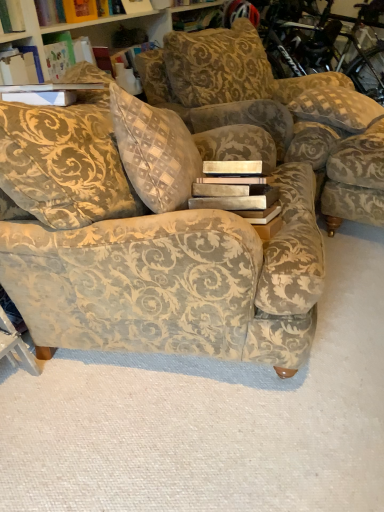
Question: Are velvet floral armchair at right and velvet-patterned couch at center making contact?

Choices:
 (A) yes
 (B) no

Answer: (B)

Question: Does velvet floral armchair at right have a smaller size compared to velvet-patterned couch at center?

Choices:
 (A) yes
 (B) no

Answer: (A)

Question: From the image's perspective, is velvet floral armchair at right beneath velvet-patterned couch at center?

Choices:
 (A) yes
 (B) no

Answer: (B)

Question: Does velvet floral armchair at right have a larger size compared to velvet-patterned couch at center?

Choices:
 (A) no
 (B) yes

Answer: (A)

Question: Is the depth of velvet floral armchair at right greater than that of velvet-patterned couch at center?

Choices:
 (A) no
 (B) yes

Answer: (B)

Question: Does velvet floral armchair at right have a greater height compared to velvet-patterned couch at center?

Choices:
 (A) no
 (B) yes

Answer: (A)

Question: Is checkered fabric pillow at upper right thinner than velvet-patterned couch at center?

Choices:
 (A) yes
 (B) no

Answer: (A)

Question: From the image's perspective, is checkered fabric pillow at upper right under velvet-patterned couch at center?

Choices:
 (A) no
 (B) yes

Answer: (A)

Question: Does checkered fabric pillow at upper right have a smaller size compared to velvet-patterned couch at center?

Choices:
 (A) no
 (B) yes

Answer: (B)

Question: From a real-world perspective, is checkered fabric pillow at upper right located beneath velvet-patterned couch at center?

Choices:
 (A) no
 (B) yes

Answer: (A)

Question: Is velvet-patterned couch at center a part of checkered fabric pillow at upper right?

Choices:
 (A) no
 (B) yes

Answer: (A)

Question: Can you confirm if checkered fabric pillow at upper right is positioned to the left of velvet-patterned couch at center?

Choices:
 (A) yes
 (B) no

Answer: (B)

Question: Is velvet-patterned couch at center to the right of checkered fabric pillow at upper right from the viewer's perspective?

Choices:
 (A) no
 (B) yes

Answer: (A)